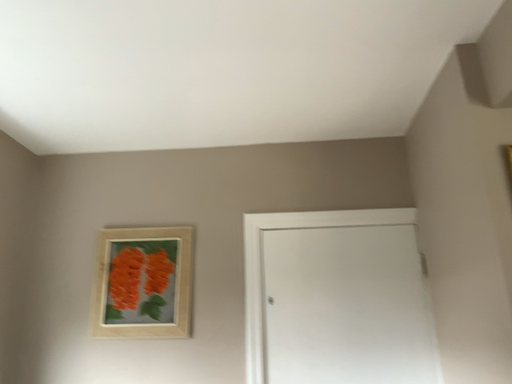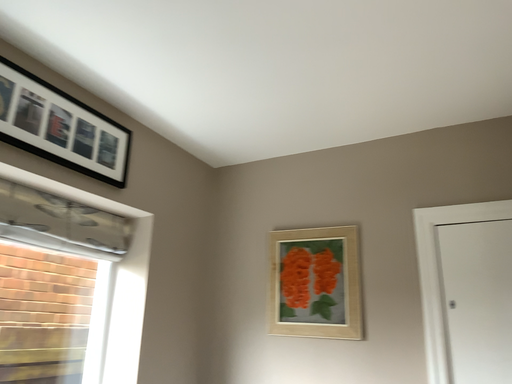
Question: How did the camera likely rotate when shooting the video?

Choices:
 (A) rotated left
 (B) rotated right

Answer: (A)